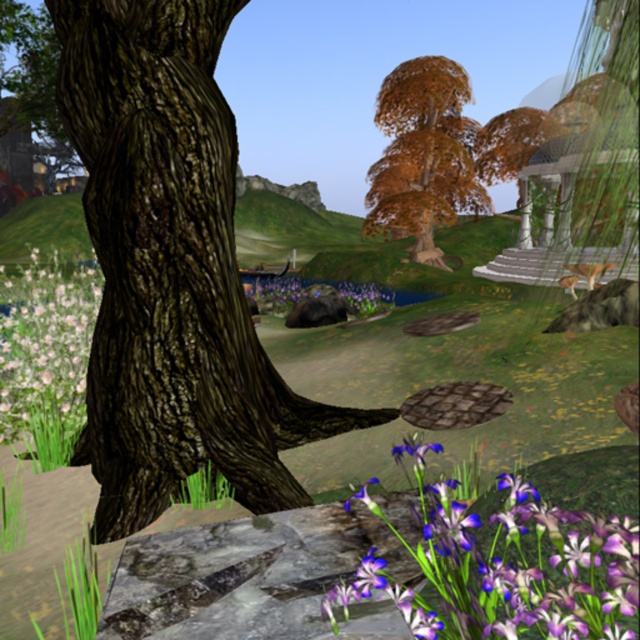
You are a character in a video game who needs to jump from the rough bark tree at left to the purple matte flowers at center. Given that your character can jump up to 10 meters, will you be able to make the jump?

The distance between the rough bark tree at left and the purple matte flowers at center is 10.49 meters, which is slightly longer than your character can jump. You will not be able to make the jump safely.

You are a painter standing on the stone pathway and want to paint both the rough bark tree at left and the purple matte flowers at center. Which object should you focus on first if you want to paint the wider object first?

The purple matte flowers at center are wider than the rough bark tree at left, so you should focus on painting the purple matte flowers at center first.